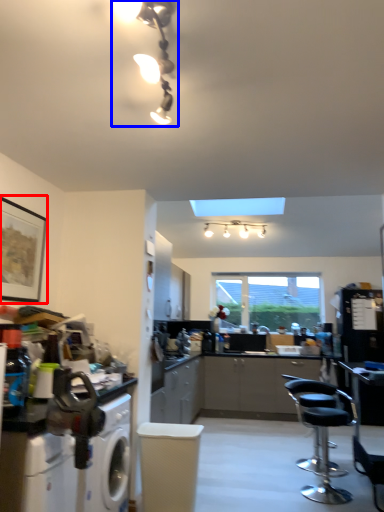
Question: Which object appears farthest to the camera in this image, picture frame (highlighted by a red box) or light fixture (highlighted by a blue box)?

Choices:
 (A) picture frame
 (B) light fixture

Answer: (A)